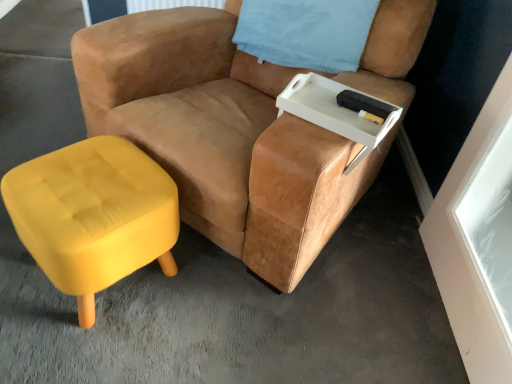
Question: From the image's perspective, is velvet yellow ottoman at lower left positioned above or below blue fabric pillow at upper right?

Choices:
 (A) below
 (B) above

Answer: (A)

Question: Visually, is velvet yellow ottoman at lower left positioned to the left or to the right of blue fabric pillow at upper right?

Choices:
 (A) left
 (B) right

Answer: (A)

Question: Which is farther from the suede tan chair at center?

Choices:
 (A) velvet yellow ottoman at lower left
 (B) white plastic tray at upper right
 (C) blue fabric pillow at upper right

Answer: (A)

Question: Which object is positioned farthest from the velvet yellow ottoman at lower left?

Choices:
 (A) white plastic tray at upper right
 (B) suede tan chair at center
 (C) blue fabric pillow at upper right

Answer: (C)